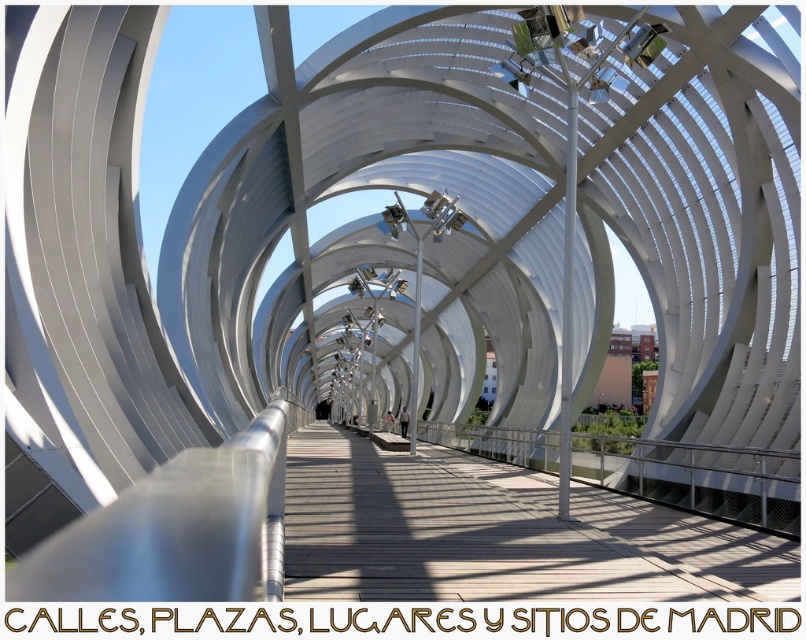
Question: Which object appears farthest from the camera in this image?

Choices:
 (A) silver metallic rail at center
 (B) wooden walkway at center

Answer: (A)

Question: Which of the following is the farthest from the observer?

Choices:
 (A) (771, 593)
 (B) (576, 449)

Answer: (B)

Question: Does wooden walkway at center have a smaller size compared to silver metallic rail at center?

Choices:
 (A) yes
 (B) no

Answer: (A)

Question: Which point is closer to the camera?

Choices:
 (A) click(622, 442)
 (B) click(393, 470)

Answer: (B)

Question: Can you confirm if wooden walkway at center is thinner than silver metallic rail at center?

Choices:
 (A) yes
 (B) no

Answer: (A)

Question: From the image, what is the correct spatial relationship of wooden walkway at center in relation to silver metallic rail at center?

Choices:
 (A) above
 (B) below

Answer: (A)